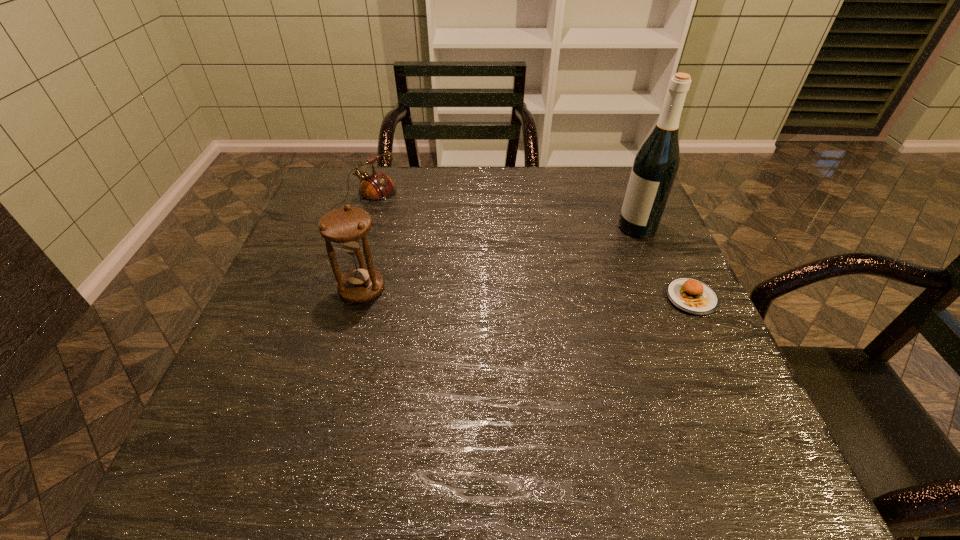
Identify the location of vacant space located on the rotary dial of the third tallest object. The image size is (960, 540). (406, 234).

The width and height of the screenshot is (960, 540). I want to click on vacant area situated on the rotary dial of the third tallest object, so click(x=468, y=268).

The image size is (960, 540). I want to click on object that is at the far edge, so click(375, 187).

Find the location of a particular element. Image resolution: width=960 pixels, height=540 pixels. hourglass that is at the left edge is located at coordinates (347, 227).

Locate an element on the screen. telephone that is at the left edge is located at coordinates (375, 187).

Identify the location of food positioned at the right edge. (694, 297).

What are the coordinates of `wine bottle that is positioned at the right edge` in the screenshot? It's located at (655, 166).

You are a GUI agent. You are given a task and a screenshot of the screen. Output one action in this format:
    pyautogui.click(x=<x>, y=<y>)
    Task: Click on the object present at the far left corner
    This screenshot has width=960, height=540.
    Given the screenshot: What is the action you would take?
    pyautogui.click(x=375, y=187)

Find the location of a particular element. vacant region at the far edge of the desktop is located at coordinates (569, 212).

Where is `vacant space at the near edge of the desktop`? The width and height of the screenshot is (960, 540). vacant space at the near edge of the desktop is located at coordinates (400, 403).